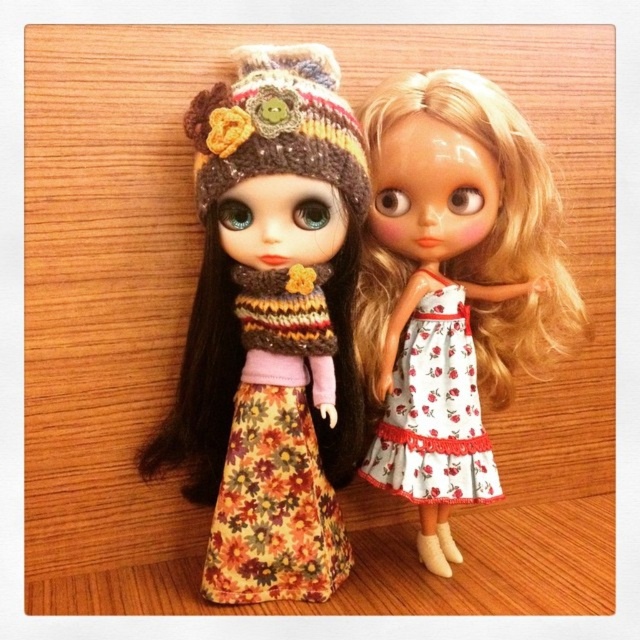
Question: Which of the following is the farthest from the observer?

Choices:
 (A) (470, 346)
 (B) (451, 461)

Answer: (A)

Question: In this image, where is floral fabric dress at center located relative to white floral fabric dress at right?

Choices:
 (A) right
 (B) left

Answer: (B)

Question: Can you confirm if white floral dress at right is wider than white floral fabric dress at right?

Choices:
 (A) yes
 (B) no

Answer: (A)

Question: Among these objects, which one is farthest from the camera?

Choices:
 (A) white floral fabric dress at right
 (B) floral fabric dress at center

Answer: (A)

Question: Is floral fabric dress at center behind white floral fabric dress at right?

Choices:
 (A) yes
 (B) no

Answer: (B)

Question: Estimate the real-world distances between objects in this image. Which object is closer to the white floral dress at right?

Choices:
 (A) floral fabric dress at center
 (B) white floral fabric dress at right

Answer: (B)